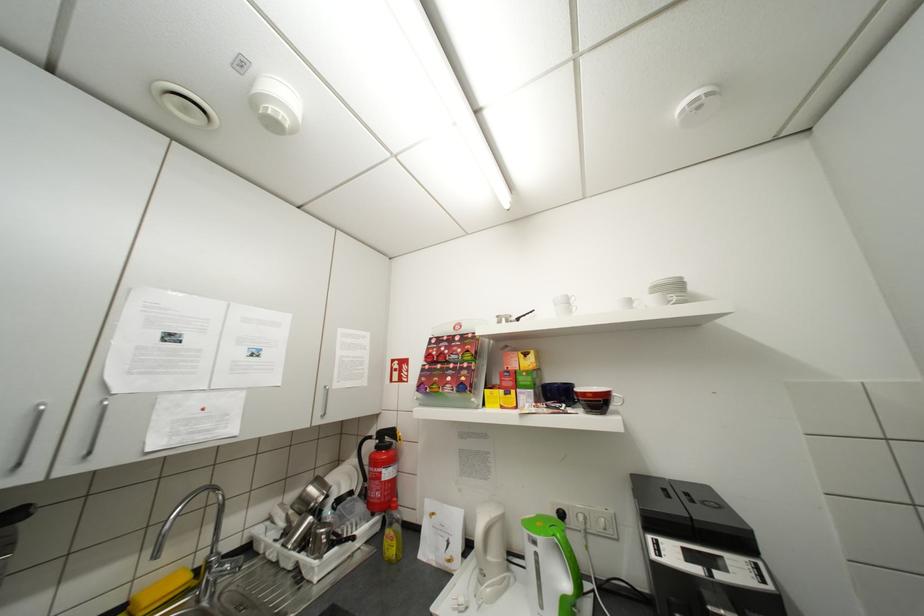
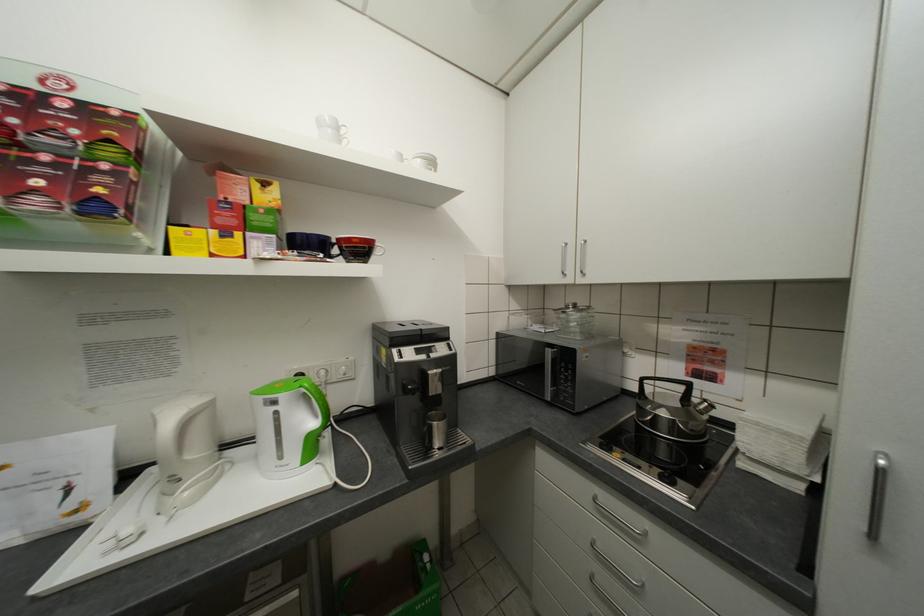
Question: The camera is either moving clockwise (left) or counter-clockwise (right) around the object. The first image is from the beginning of the video and the second image is from the end. Is the camera moving left or right when shooting the video?

Choices:
 (A) Left
 (B) Right

Answer: (A)